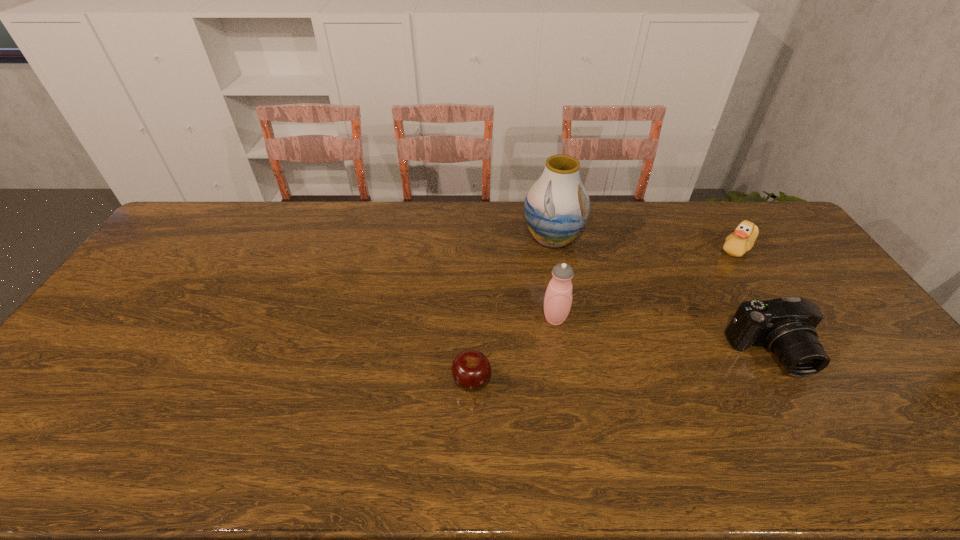
The height and width of the screenshot is (540, 960). I want to click on blank area at the right edge, so click(x=798, y=289).

At what (x,y) coordinates should I click in order to perform the action: click on vacant space at the far left corner. Please return your answer as a coordinate pair (x, y). Looking at the image, I should click on (x=216, y=216).

Where is `vacant space at the near left corner of the desktop`? The width and height of the screenshot is (960, 540). vacant space at the near left corner of the desktop is located at coordinates (11, 438).

At what (x,y) coordinates should I click in order to perform the action: click on blank region between the thermos bottle and the duck. Please return your answer as a coordinate pair (x, y). The image size is (960, 540). Looking at the image, I should click on (646, 284).

I want to click on vacant area between the camera and the fourth shortest object, so click(662, 336).

Locate an element on the screen. The image size is (960, 540). free space between the shortest object and the camera is located at coordinates (621, 367).

Locate an element on the screen. Image resolution: width=960 pixels, height=540 pixels. free space between the duck and the second tallest object is located at coordinates [646, 284].

Locate an element on the screen. This screenshot has height=540, width=960. free point between the second tallest object and the duck is located at coordinates (646, 284).

Where is `empty location between the third nearest object and the camera`? The height and width of the screenshot is (540, 960). empty location between the third nearest object and the camera is located at coordinates (662, 336).

Locate an element on the screen. the second closest object to the camera is located at coordinates (558, 298).